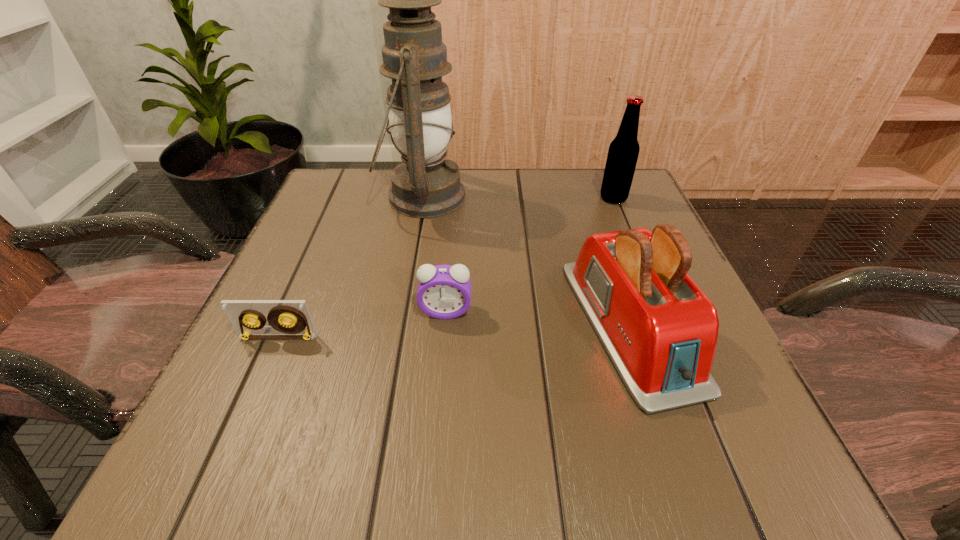
You are a GUI agent. You are given a task and a screenshot of the screen. Output one action in this format:
    pyautogui.click(x=<x>, y=<y>)
    Task: Click on the free space at the near edge
    The width and height of the screenshot is (960, 540).
    Given the screenshot: What is the action you would take?
    pyautogui.click(x=486, y=481)

Where is `free location at the left edge of the desktop`? free location at the left edge of the desktop is located at coordinates (343, 251).

The width and height of the screenshot is (960, 540). Identify the location of vacant space at the far left corner of the desktop. (373, 219).

Identify the location of vacant space at the near left corner. (308, 441).

In the image, there is a desktop. At what (x,y) coordinates should I click in order to perform the action: click on blank space at the far right corner. Please return your answer as a coordinate pair (x, y). The height and width of the screenshot is (540, 960). Looking at the image, I should click on point(588,218).

Identify the location of free space at the near right corner of the desktop. The image size is (960, 540). (701, 472).

I want to click on free spot between the shortest object and the second shortest object, so click(x=362, y=325).

This screenshot has width=960, height=540. What are the coordinates of `vacant area that lies between the third shortest object and the second shortest object` in the screenshot? It's located at (538, 318).

This screenshot has width=960, height=540. Identify the location of unoccupied area between the alarm clock and the shortest object. (362, 325).

You are a GUI agent. You are given a task and a screenshot of the screen. Output one action in this format:
    pyautogui.click(x=<x>, y=<y>)
    Task: Click on the vacant space that is in between the third tallest object and the leftmost object
    Image resolution: width=960 pixels, height=540 pixels.
    Given the screenshot: What is the action you would take?
    pyautogui.click(x=454, y=331)